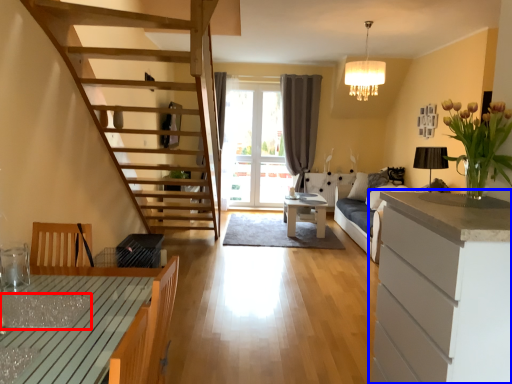
Question: Which of the following is the closest to the observer, glass table (highlighted by a red box) or cabinetry (highlighted by a blue box)?

Choices:
 (A) glass table
 (B) cabinetry

Answer: (B)